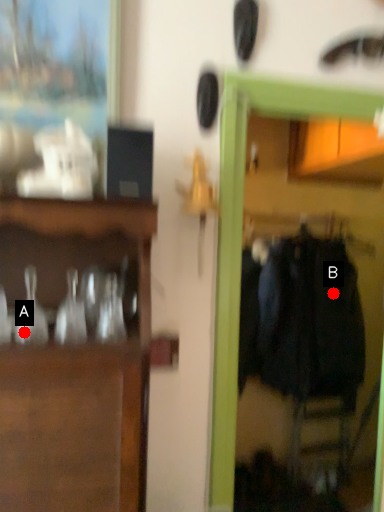
Question: Two points are circled on the image, labeled by A and B beside each circle. Which point is closer to the camera taking this photo?

Choices:
 (A) A is closer
 (B) B is closer

Answer: (A)